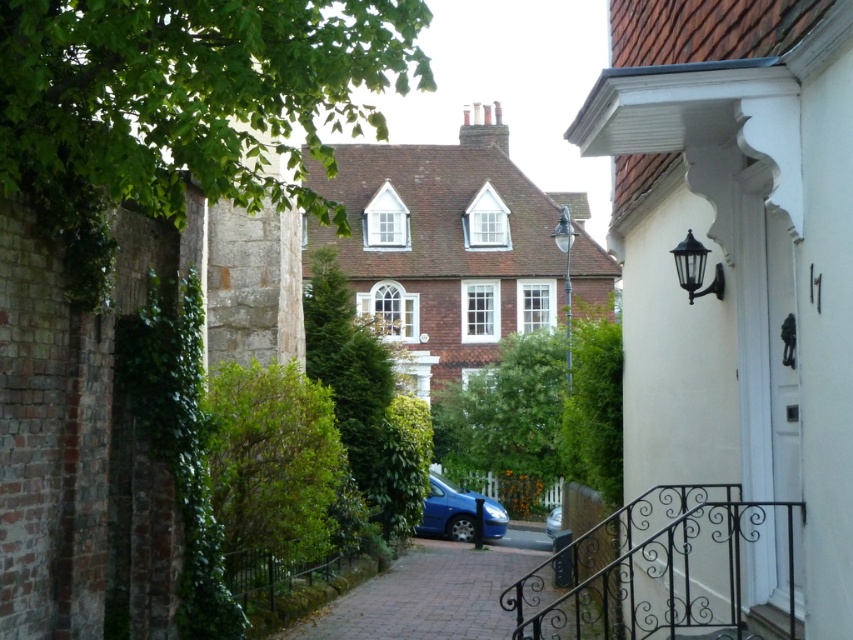
You need to park your new car which is the same size as the metallic blue car at center. The brick paved driveway at center is the only available parking spot. Will your car fit in the driveway?

The brick paved driveway at center has a larger size compared to metallic blue car at center, so yes, your car will fit in the driveway since it is bigger than the metallic blue car at center.

You are a delivery person trying to park your metallic blue car at center in the residential area. There is already a blue metallic car at center parked there. Which car should you move to make space for your car?

The blue metallic car at center is above the metallic blue car at center, so you should move the blue metallic car at center to make space for your metallic blue car at center.